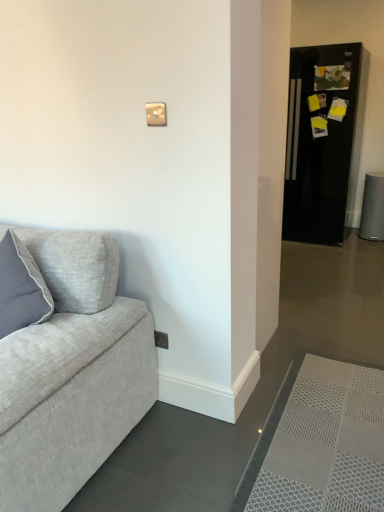
Question: From a real-world perspective, does black glossy refrigerator at right stand above matte white light switch at upper center?

Choices:
 (A) no
 (B) yes

Answer: (A)

Question: From the image's perspective, does black glossy refrigerator at right appear lower than matte white light switch at upper center?

Choices:
 (A) no
 (B) yes

Answer: (A)

Question: Is matte white light switch at upper center a part of black glossy refrigerator at right?

Choices:
 (A) no
 (B) yes

Answer: (A)

Question: Is black glossy refrigerator at right far from matte white light switch at upper center?

Choices:
 (A) yes
 (B) no

Answer: (A)

Question: Can you confirm if black glossy refrigerator at right is bigger than matte white light switch at upper center?

Choices:
 (A) no
 (B) yes

Answer: (B)

Question: Considering the relative sizes of black glossy refrigerator at right and matte white light switch at upper center in the image provided, is black glossy refrigerator at right shorter than matte white light switch at upper center?

Choices:
 (A) no
 (B) yes

Answer: (A)

Question: Can you confirm if black glossy refrigerator at right is bigger than white mesh doormat at lower right?

Choices:
 (A) no
 (B) yes

Answer: (B)

Question: From a real-world perspective, is black glossy refrigerator at right located beneath white mesh doormat at lower right?

Choices:
 (A) yes
 (B) no

Answer: (B)

Question: From the image's perspective, is black glossy refrigerator at right located above white mesh doormat at lower right?

Choices:
 (A) no
 (B) yes

Answer: (B)

Question: Can you confirm if black glossy refrigerator at right is wider than white mesh doormat at lower right?

Choices:
 (A) yes
 (B) no

Answer: (B)

Question: Can you confirm if black glossy refrigerator at right is smaller than white mesh doormat at lower right?

Choices:
 (A) no
 (B) yes

Answer: (A)

Question: From a real-world perspective, is black glossy refrigerator at right located higher than white mesh doormat at lower right?

Choices:
 (A) no
 (B) yes

Answer: (B)

Question: Is matte white light switch at upper center shorter than black glossy refrigerator at right?

Choices:
 (A) no
 (B) yes

Answer: (B)